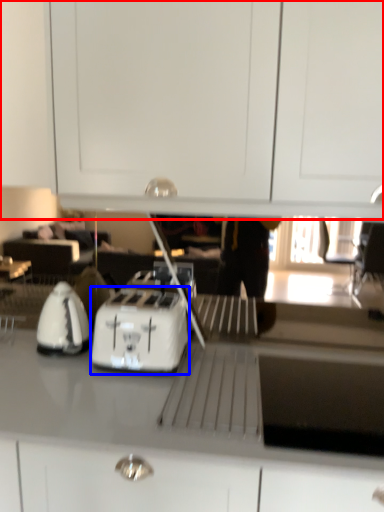
Question: Which of the following is the closest to the observer, dresser (highlighted by a red box) or kitchen appliance (highlighted by a blue box)?

Choices:
 (A) dresser
 (B) kitchen appliance

Answer: (A)